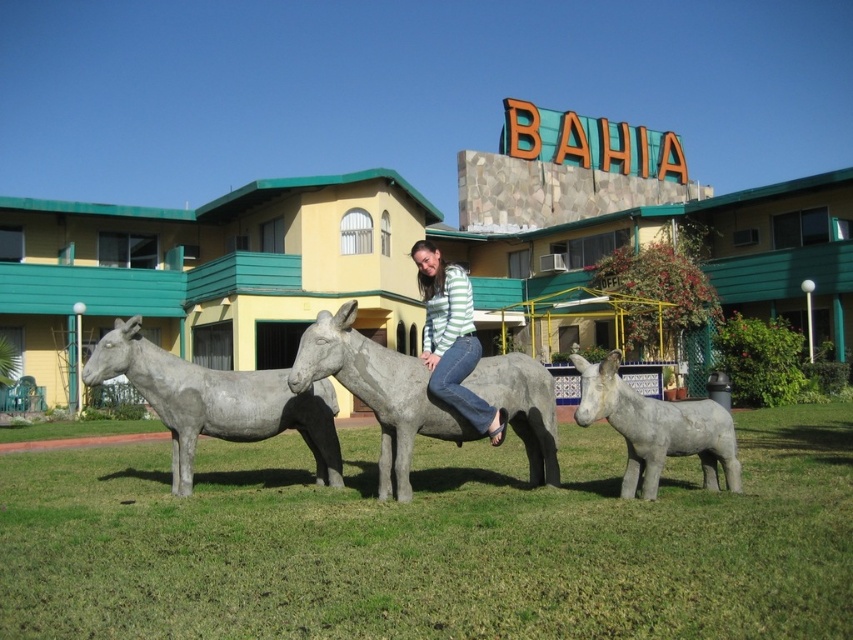
Does gray stone donkey at center have a lesser width compared to gray stone donkey at lower right?

In fact, gray stone donkey at center might be wider than gray stone donkey at lower right.

Which is behind, point (122, 356) or point (643, 468)?

The point (122, 356) is more distant.

Find the location of `gray stone donkey at center`. gray stone donkey at center is located at coordinates (218, 401).

Is gray stone donkey at lower right to the right of striped sweater at center from the viewer's perspective?

Correct, you'll find gray stone donkey at lower right to the right of striped sweater at center.

Which is in front, point (712, 456) or point (440, 282)?

Positioned in front is point (712, 456).

You are a GUI agent. You are given a task and a screenshot of the screen. Output one action in this format:
    pyautogui.click(x=<x>, y=<y>)
    Task: Click on the gray stone donkey at lower right
    
    Given the screenshot: What is the action you would take?
    pyautogui.click(x=656, y=428)

Who is more forward, (x=343, y=368) or (x=235, y=413)?

Positioned in front is point (x=343, y=368).

Who is higher up, gray stone mule at center or gray stone donkey at center?

gray stone mule at center is above.

Does point (410, 381) come behind point (187, 428)?

No.

This screenshot has width=853, height=640. What are the coordinates of `gray stone mule at center` in the screenshot? It's located at (378, 392).